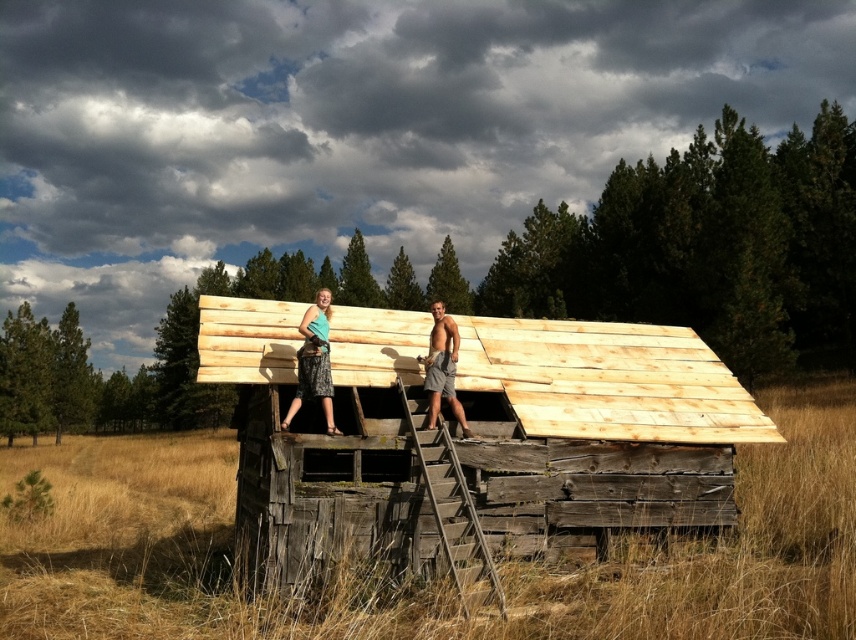
You are standing at the base of the ladder in the image. The point at coordinates point (259, 532) is part of the structure you need to reach. If you can throw a tool 10 meters, will you be able to reach that point with your throw?

The distance of point (259, 532) from viewer is 9.73 meters, so yes, you can reach it with a 10 meter throw.

You are standing at the base of the ladder in the rural setting. You see two points marked in the image. Which point is closer to you, point (306, 320) or point (438, 374)?

Point (306, 320) is in front of point (438, 374), so it is closer to you.

You are standing at the origin point in the image. Which direction should you move to reach the light brown wooden hut at center?

The light brown wooden hut at center is located at point (473, 440), which is to the right and slightly forward from your current position at the origin. Move towards the right and forward to reach it.